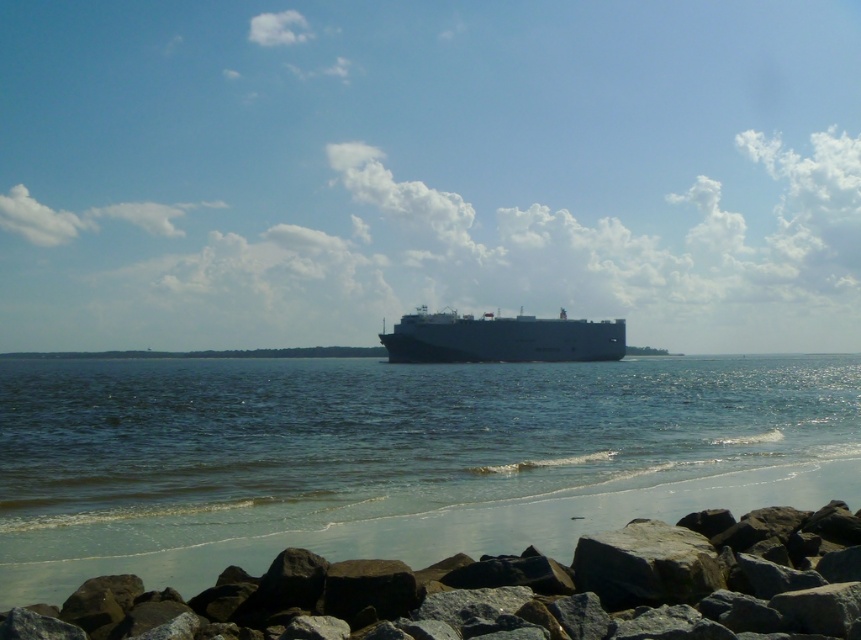
You are standing on the rocky shoreline and see the dark gray rock at lower center and the white matte cargo ship at center. Which object is closer to the water surface?

The dark gray rock at lower center is closer to the water surface because it is positioned below the white matte cargo ship at center.

You are standing on the rocky shoreline and want to reach the point marked at coordinates (x=197, y=436). Given that the distance from you to that point is 32.26 meters, and the water depth at that point is 1.5 meters, can you safely walk there without getting your feet wet if the tide is currently at its highest?

The point marked at coordinates (x=197, y=436) is 32.26 meters away from you. However, the water depth at that point is 1.5 meters, which means it is submerged during high tide. Therefore, walking there would result in getting your feet wet.